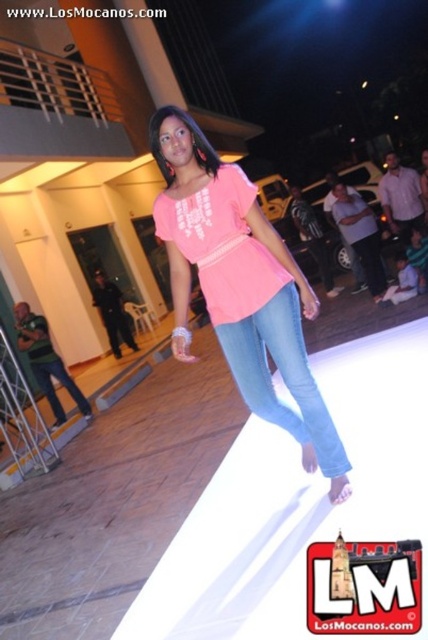
You are standing at the point with coordinates point (240,285) and want to move towards the pink matte t shirt at center. Can you reach it without moving?

Yes, because the point (240,285) is already on the pink matte t shirt at center.